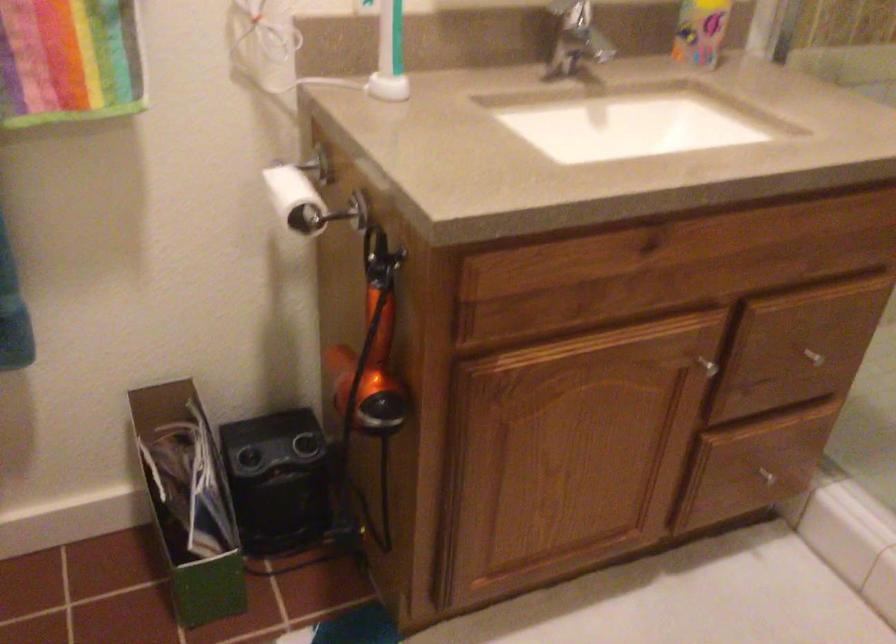
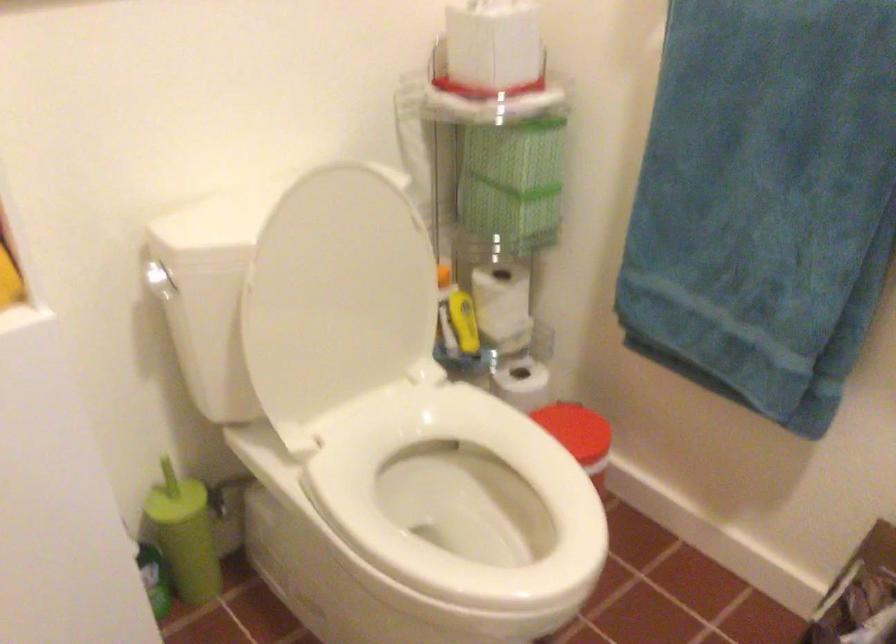
Question: How did the camera likely rotate?

Choices:
 (A) Left
 (B) Right
 (C) Up
 (D) Down

Answer: (A)